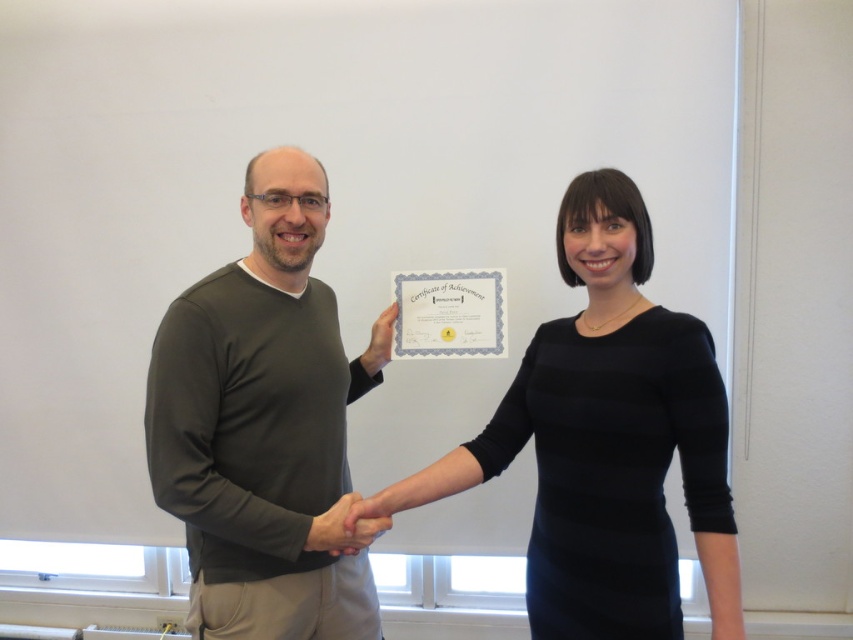
Who is higher up, dark green sweater at center or black matte dress at center?

black matte dress at center is higher up.

Is point (289, 188) positioned after point (579, 240)?

Yes, point (289, 188) is farther from viewer.

Where is `dark green sweater at center`? This screenshot has width=853, height=640. dark green sweater at center is located at coordinates (265, 426).